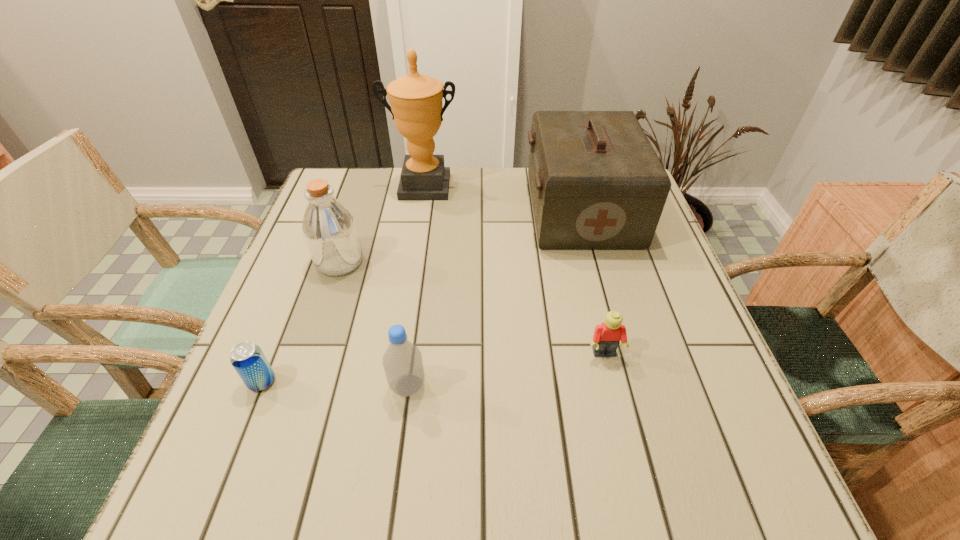
Locate an element on the screen. This screenshot has height=540, width=960. free space at the far edge of the desktop is located at coordinates (479, 212).

Find the location of a particular element. This screenshot has height=540, width=960. blank space at the near edge of the desktop is located at coordinates (591, 472).

Image resolution: width=960 pixels, height=540 pixels. What are the coordinates of `vacant space at the right edge of the desktop` in the screenshot? It's located at (670, 416).

In order to click on vacant space at the far left corner in this screenshot , I will do (x=348, y=196).

Locate an element on the screen. free point between the first-aid kit and the tallest object is located at coordinates (502, 198).

Where is `free space between the first-aid kit and the tallest object`? This screenshot has width=960, height=540. free space between the first-aid kit and the tallest object is located at coordinates (502, 198).

Find the location of a particular element. vacant area between the tallest object and the right bottle is located at coordinates click(x=416, y=286).

Where is `free space between the right bottle and the first-aid kit`? free space between the right bottle and the first-aid kit is located at coordinates (494, 298).

The height and width of the screenshot is (540, 960). What are the coordinates of `vacant space that is in between the left bottle and the Lego` in the screenshot? It's located at (472, 308).

Locate an element on the screen. The image size is (960, 540). unoccupied position between the first-aid kit and the left bottle is located at coordinates (461, 236).